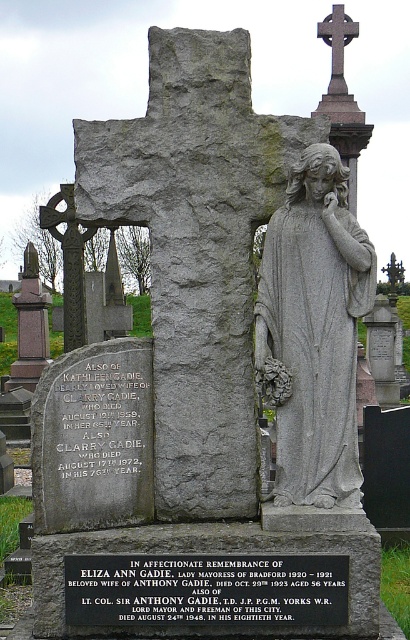
Question: Does gray stone statue at center come behind black metal plaque at center?

Choices:
 (A) yes
 (B) no

Answer: (B)

Question: Can you confirm if gray stone statue at center is wider than smooth stone cross at upper center?

Choices:
 (A) no
 (B) yes

Answer: (B)

Question: Does gray stone statue at center appear on the right side of smooth stone cross at upper center?

Choices:
 (A) no
 (B) yes

Answer: (A)

Question: Which of these objects is positioned closest to the smooth stone cross at upper center?

Choices:
 (A) black metal plaque at center
 (B) gray stone statue at center

Answer: (B)

Question: Which point is closer to the camera?

Choices:
 (A) (104, 560)
 (B) (332, 65)
 (C) (348, 497)

Answer: (A)

Question: Among these objects, which one is farthest from the camera?

Choices:
 (A) gray stone statue at center
 (B) black metal plaque at center

Answer: (B)